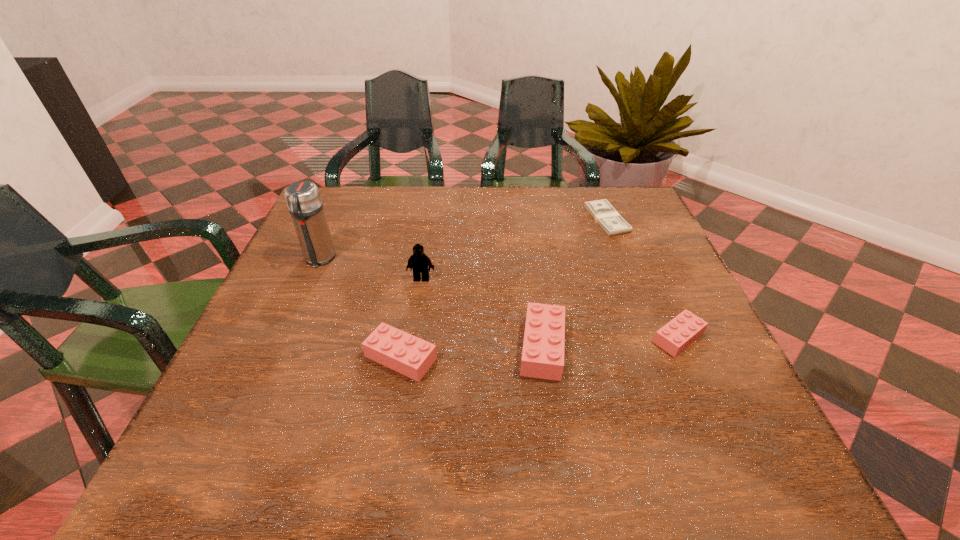
Identify which Lego is located as the second nearest to the third tallest object. Please provide its 2D coordinates. Your answer should be formatted as a tuple, i.e. [(x, y)], where the tuple contains the x and y coordinates of a point satisfying the conditions above.

[(675, 336)]

In order to click on free space in the image that satisfies the following two spatial constraints: 1. with a handle on the side of the tallest object; 2. on the right side of the second shortest Lego in this screenshot , I will do `click(276, 357)`.

What are the coordinates of `vacant space that satisfies the following two spatial constraints: 1. with a handle on the side of the leftmost object; 2. on the left side of the second tallest Lego` in the screenshot? It's located at (280, 347).

Where is `free location that satisfies the following two spatial constraints: 1. with a handle on the side of the tallest object; 2. on the right side of the third tallest Lego`? free location that satisfies the following two spatial constraints: 1. with a handle on the side of the tallest object; 2. on the right side of the third tallest Lego is located at coordinates (276, 357).

This screenshot has width=960, height=540. I want to click on vacant space that satisfies the following two spatial constraints: 1. on the back side of the fourth object from left to right; 2. on the left side of the shortest Lego, so click(541, 338).